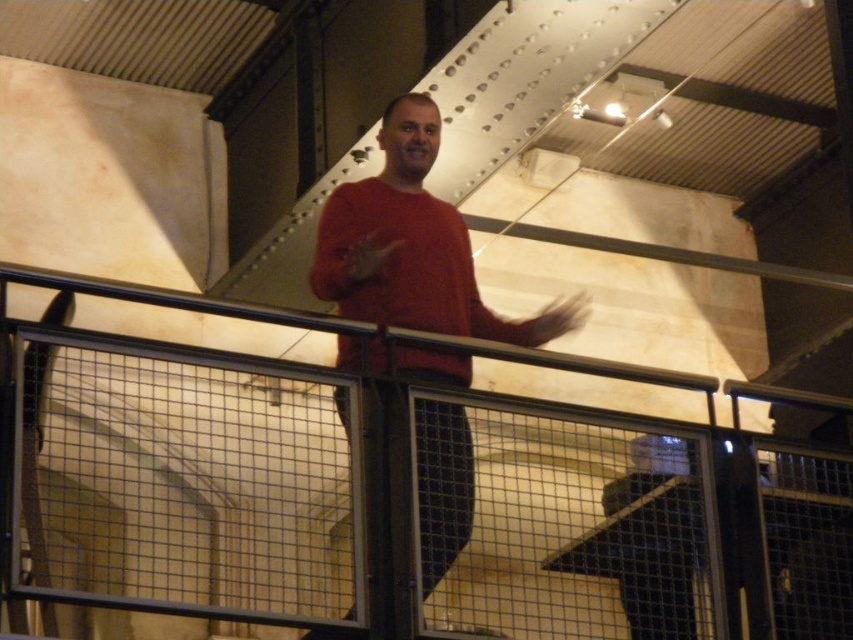
You are an interior designer assessing the layout of a space. You notice the matte red sweater at center and the black metal railing at upper center. Based on their positions, which object is closer to the left side of the scene?

The matte red sweater at center is closer to the left side of the scene because it is positioned to the left of the black metal railing at upper center.

You are designing a safety inspection checklist for this industrial area. Based on the image, which object between the matte red sweater at center and the black metal railing at upper center should be prioritized for inspection due to its larger size?

The black metal railing at upper center should be prioritized for inspection because it has a larger size compared to the matte red sweater at center.

You are an interior designer planning to place a decorative item on a shelf in the scene. The shelf is positioned at coordinates point 0.4, 0.5. Will the matte red sweater at center interfere with the placement of the decorative item?

The matte red sweater at center is located at point (413, 246), which is very close to the shelf at (426, 256). Therefore, the sweater might interfere with placing the decorative item there unless moved.